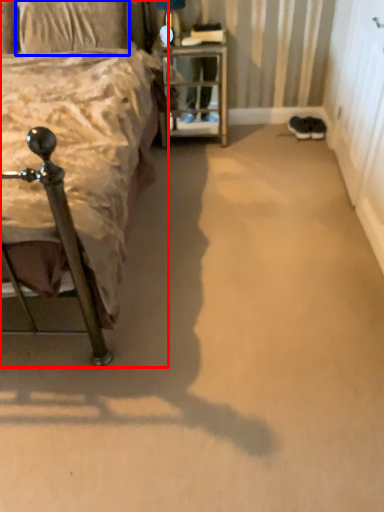
Question: Which point is closer to the camera, bed (highlighted by a red box) or pillow (highlighted by a blue box)?

Choices:
 (A) bed
 (B) pillow

Answer: (A)